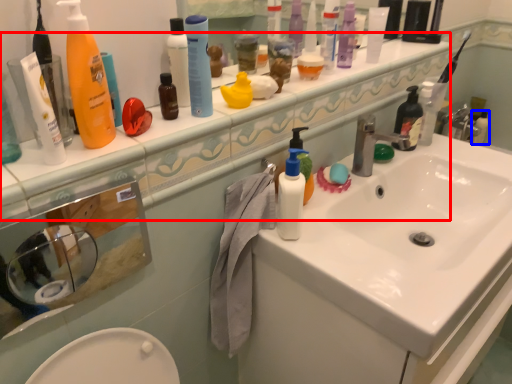
Question: Among these objects, which one is nearest to the camera, counter top (highlighted by a red box) or toiletry (highlighted by a blue box)?

Choices:
 (A) counter top
 (B) toiletry

Answer: (A)